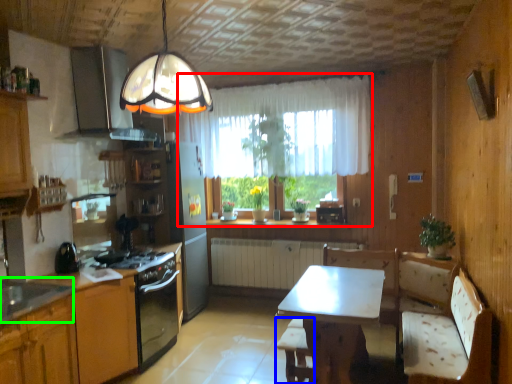
Question: Which is nearer to the window (highlighted by a red box)? bar stool (highlighted by a blue box) or sink (highlighted by a green box).

Choices:
 (A) bar stool
 (B) sink

Answer: (A)